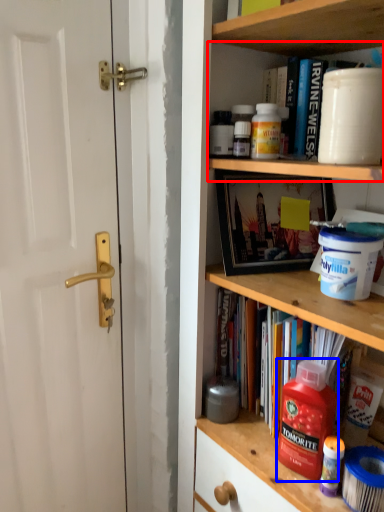
Question: Which point is closer to the camera, cabinet (highlighted by a red box) or cleaning product (highlighted by a blue box)?

Choices:
 (A) cabinet
 (B) cleaning product

Answer: (B)